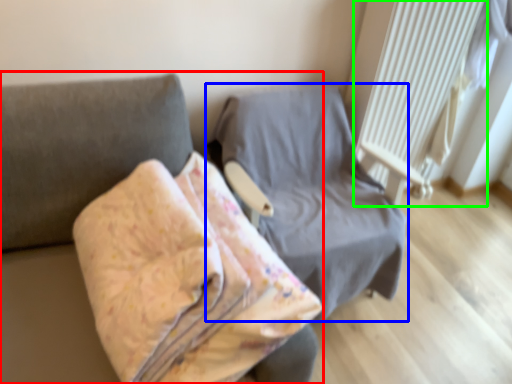
Question: Considering the real-world distances, which object is farthest from furniture (highlighted by a red box)? furniture (highlighted by a blue box) or radiator (highlighted by a green box)?

Choices:
 (A) furniture
 (B) radiator

Answer: (B)